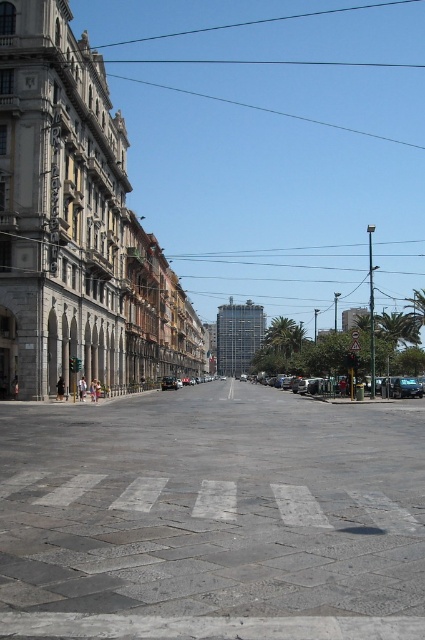
You are a delivery driver approaching the intersection and need to read the metallic reflective sign at center. Can you see the sign clearly while driving past the metallic silver car at center?

The metallic reflective sign at center is positioned over the metallic silver car at center, so yes, the sign is visible above the car and can be read clearly while driving past.

You are standing at the pedestrian crossing in the foreground of the urban street scene. You want to cross the street to the buildings on the left. Is the metallic silver car at right blocking your path?

The metallic silver car at right is located at point (405, 387), which is near the far edge of the image. Since you are at the pedestrian crossing in the foreground, the metallic silver car at right is positioned far away and not in your immediate path, so it does not block your way.

You are a delivery person standing at the pedestrian crossing on the cobblestone pavement. You need to deliver a package to the gray concrete plaza at center and the metallic reflective sign at center. Which object should you approach first based on their positions?

The gray concrete plaza at center is to the left of metallic reflective sign at center, so you should approach the gray concrete plaza at center first since it is located to the left side of the metallic reflective sign at center.